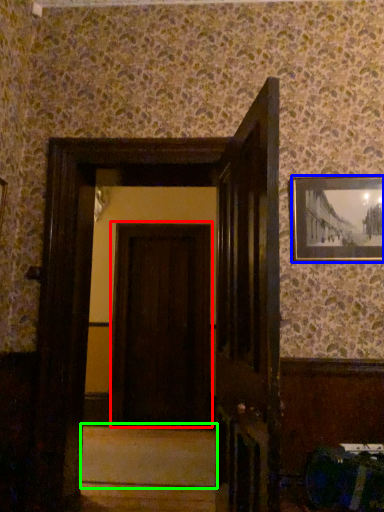
Question: Considering the real-world distances, which object is farthest from door (highlighted by a red box)? picture frame (highlighted by a blue box) or stair (highlighted by a green box)?

Choices:
 (A) picture frame
 (B) stair

Answer: (A)